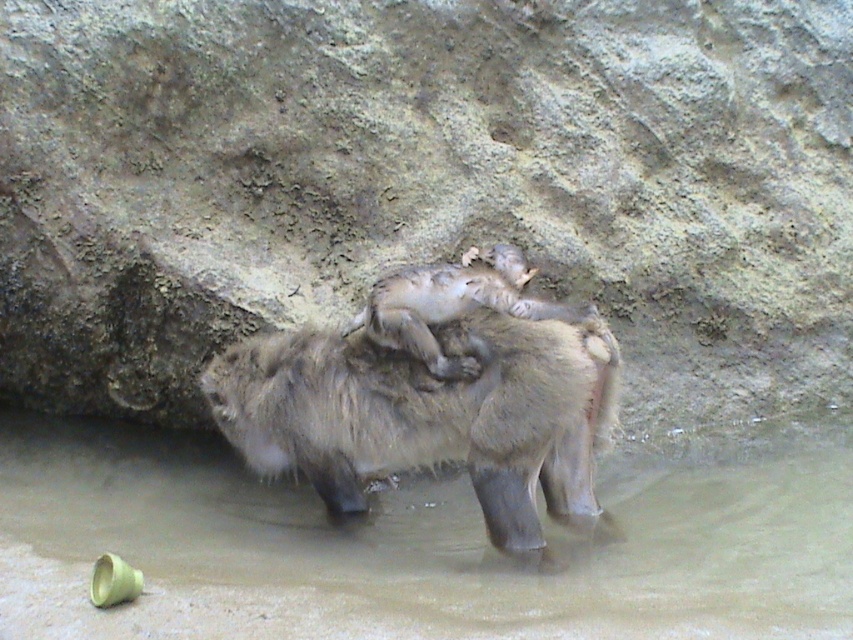
You are a photographer trying to capture the primates in the water. To ensure the brown rough rock at center is in the background of your photo, where should you position the camera relative to the primates?

To have the brown rough rock at center in the background, position the camera so the primates are between you and the rock. Since the rock is at the center, placing the primates in front of it would naturally place the rock behind them in the frame.